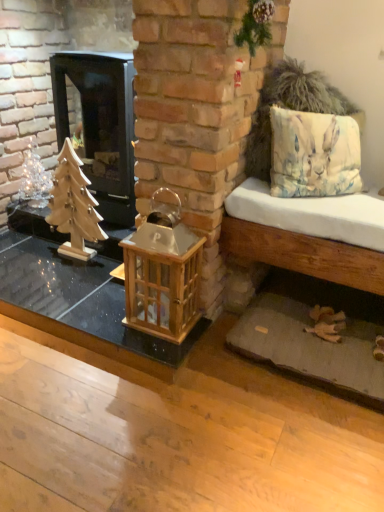
Identify the location of vacant space in wooden christmas tree at left (from a real-world perspective). (86, 260).